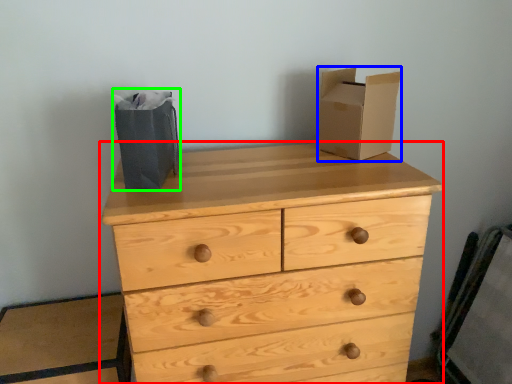
Question: Which object is positioned farthest from chest of drawers (highlighted by a red box)? Select from cardboard box (highlighted by a blue box) and shopping bag (highlighted by a green box).

Choices:
 (A) cardboard box
 (B) shopping bag

Answer: (B)